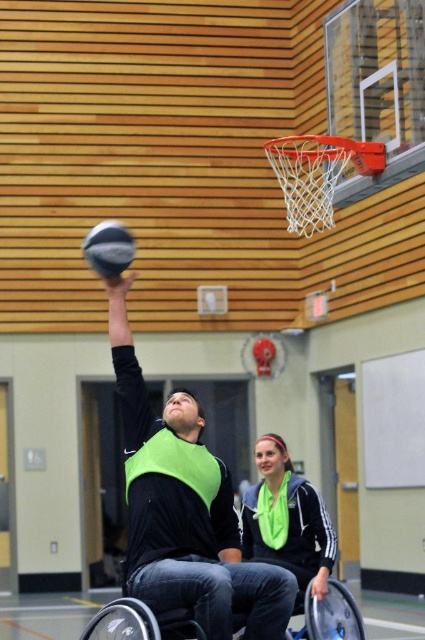
You are a photographer setting up for a basketball game photo shoot in the gym. You need to position a camera to capture the wheelchair and the basketball hoop clearly. Given that the silver metallic wheelchair at center is larger than the metallic silver basketball hoop at center, which object should you focus on first to ensure both are in frame?

Since the silver metallic wheelchair at center is larger than the metallic silver basketball hoop at center, you should focus on the silver metallic wheelchair at center first to ensure it fits within the frame, allowing space for the smaller basketball hoop.

You are a photographer positioned at the back of the gymnasium. You want to capture a photo of the green fabric scarf at center and the rubber textured basketball at center. Which object should you focus on first if you want to include both in your shot without moving the camera?

The green fabric scarf at center is to the right of the rubber textured basketball at center. Since they are both at the center, you can focus on either one first as they are positioned closely together.

You are a photographer trying to capture the perfect shot of the green fabric scarf at center. Given that the camera is set to focus at point coordinates (286, 520), will the green fabric scarf at center be in focus?

The point coordinates (286, 520) correspond to the green fabric scarf at center, so yes, the green fabric scarf at center will be in focus since the camera is focused at that point.